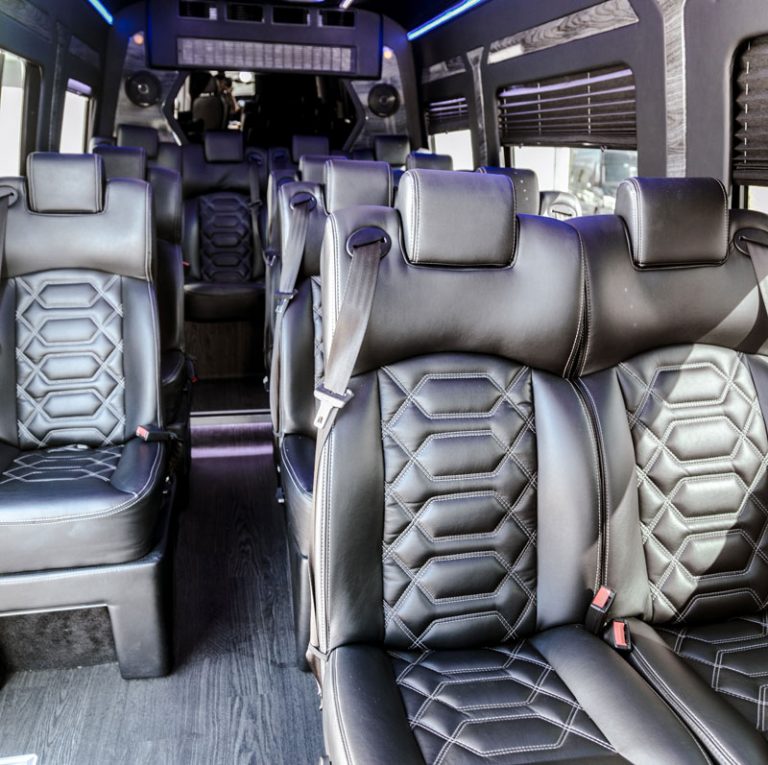
Identify the location of seat backs. (458, 506), (697, 509), (97, 350), (313, 252), (222, 209).